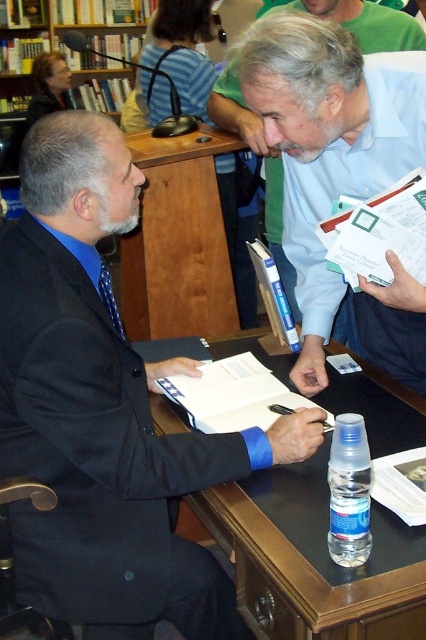
Which of these two, black matte suit at center or white paper at upper center, stands taller?

Standing taller between the two is black matte suit at center.

Does black matte suit at center have a greater width compared to white paper at upper center?

Indeed, black matte suit at center has a greater width compared to white paper at upper center.

Between point (158, 544) and point (367, 314), which one is positioned in front?

Point (158, 544) is in front.

Find the location of `black matte suit at center`. black matte suit at center is located at coordinates (103, 410).

Can you confirm if brown wood table at center is thinner than white paper at center?

No.

Can you confirm if brown wood table at center is bigger than white paper at center?

Yes, brown wood table at center is bigger than white paper at center.

Which is behind, point (141, 241) or point (181, 388)?

Positioned behind is point (141, 241).

Where is `brown wood table at center`? The image size is (426, 640). brown wood table at center is located at coordinates [x=178, y=241].

From the picture: Does white paper at upper center have a smaller size compared to brown wood table at center?

Incorrect, white paper at upper center is not smaller in size than brown wood table at center.

Does white paper at upper center appear on the right side of brown wood table at center?

Yes, white paper at upper center is to the right of brown wood table at center.

Between point (386, 310) and point (167, 168), which one is positioned behind?

Positioned behind is point (167, 168).

Where is `white paper at upper center`? The width and height of the screenshot is (426, 640). white paper at upper center is located at coordinates (328, 144).